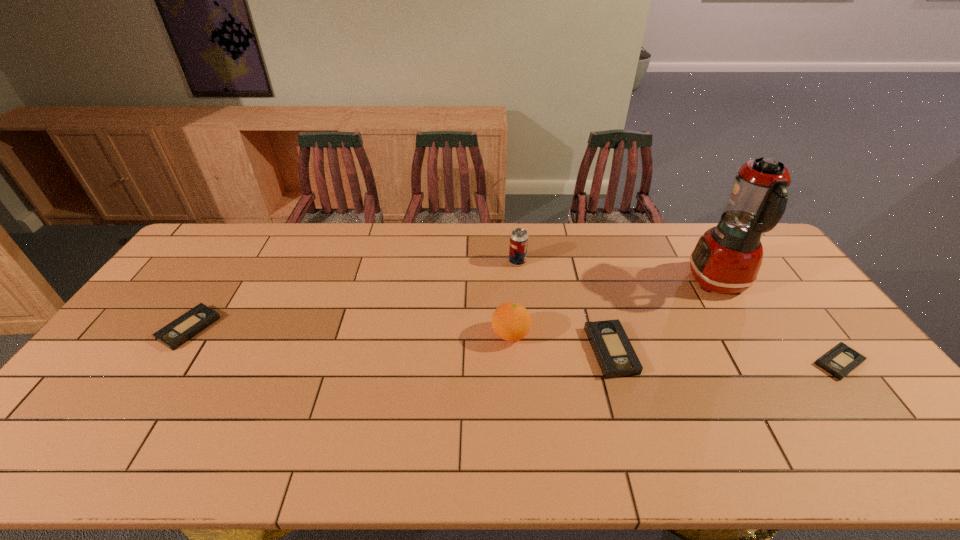
Where is `videotape that is the third nearest to the orange`? videotape that is the third nearest to the orange is located at coordinates (173, 335).

Identify which videotape is located as the second nearest to the third object from right to left. Please provide its 2D coordinates. Your answer should be formatted as a tuple, i.e. [(x, y)], where the tuple contains the x and y coordinates of a point satisfying the conditions above.

[(173, 335)]

Where is `vacant space that satisfies the following two spatial constraints: 1. on the front side of the beer can; 2. on the right side of the shortest object`? vacant space that satisfies the following two spatial constraints: 1. on the front side of the beer can; 2. on the right side of the shortest object is located at coordinates (528, 362).

Where is `free space that satisfies the following two spatial constraints: 1. on the front side of the orange; 2. on the left side of the fifth tallest object`? Image resolution: width=960 pixels, height=540 pixels. free space that satisfies the following two spatial constraints: 1. on the front side of the orange; 2. on the left side of the fifth tallest object is located at coordinates (185, 335).

I want to click on vacant space that satisfies the following two spatial constraints: 1. on the controls of the second object from right to left; 2. on the front side of the orange, so click(x=750, y=335).